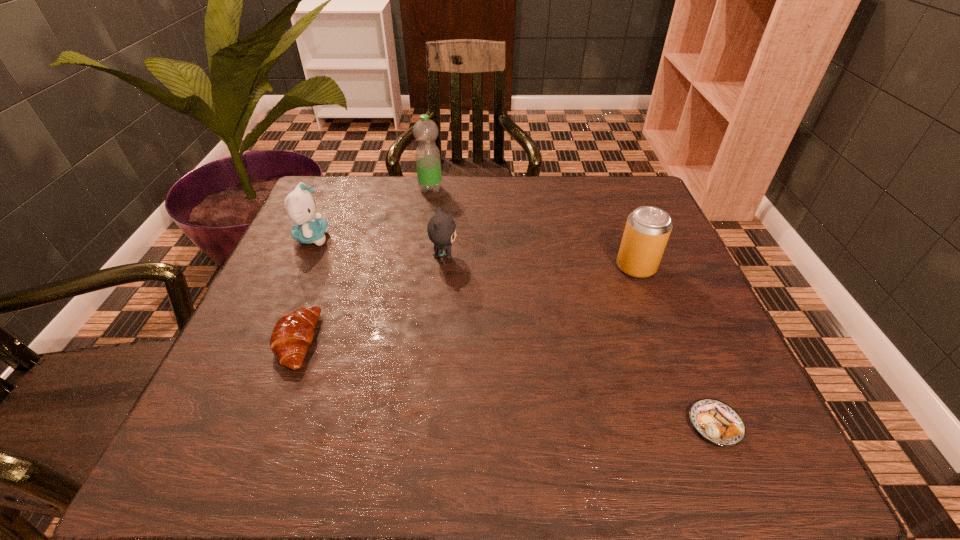
This screenshot has height=540, width=960. Find the location of `free space located 0.340m on the front of the farthest object`. free space located 0.340m on the front of the farthest object is located at coordinates (417, 279).

Where is `free space located 0.150m on the left of the pop (soda)`? free space located 0.150m on the left of the pop (soda) is located at coordinates (550, 267).

Locate an element on the screen. The image size is (960, 540). free location located 0.340m on the face of the left kitten is located at coordinates (468, 238).

Identify the location of vacant space located on the front-facing side of the fourth tallest object. This screenshot has width=960, height=540. (548, 256).

The height and width of the screenshot is (540, 960). I want to click on vacant space located on the right of the crescent roll, so click(390, 341).

Identify the location of vacant space located 0.080m on the left of the pastry. The height and width of the screenshot is (540, 960). (639, 424).

Find the location of `water bottle present at the far edge`. water bottle present at the far edge is located at coordinates (428, 164).

The image size is (960, 540). Find the location of `kitten that is at the far edge`. kitten that is at the far edge is located at coordinates (300, 205).

This screenshot has width=960, height=540. In order to click on object positioned at the near edge in this screenshot , I will do `click(717, 422)`.

This screenshot has width=960, height=540. Identify the location of kitten at the left edge. (300, 205).